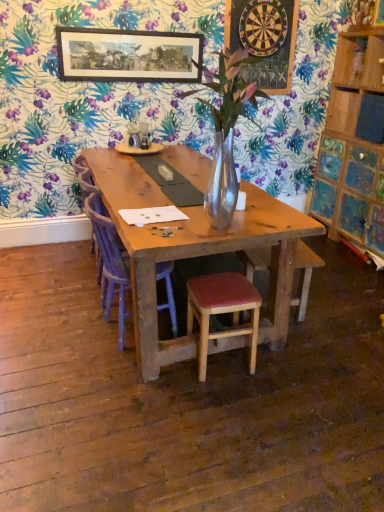
Question: From the image's perspective, is purple wood chair at center positioned above or below wooden framed print at upper center?

Choices:
 (A) above
 (B) below

Answer: (B)

Question: Considering the positions of purple wood chair at center and wooden framed print at upper center in the image, is purple wood chair at center bigger or smaller than wooden framed print at upper center?

Choices:
 (A) big
 (B) small

Answer: (A)

Question: Estimate the real-world distances between objects in this image. Which object is farther from the wooden dartboard at upper center?

Choices:
 (A) wooden stool with red cushion at center
 (B) purple wood chair at center
 (C) purple fabric armchair at center
 (D) wooden framed print at upper center

Answer: (A)

Question: Which object is the closest to the wooden framed print at upper center?

Choices:
 (A) purple wood chair at center
 (B) purple fabric armchair at center
 (C) wooden stool with red cushion at center
 (D) wooden dartboard at upper center

Answer: (D)